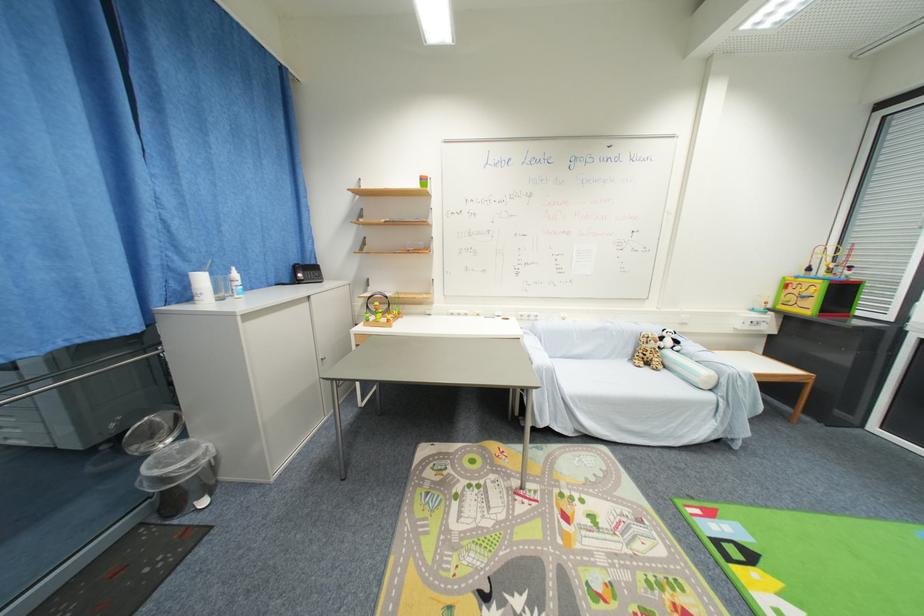
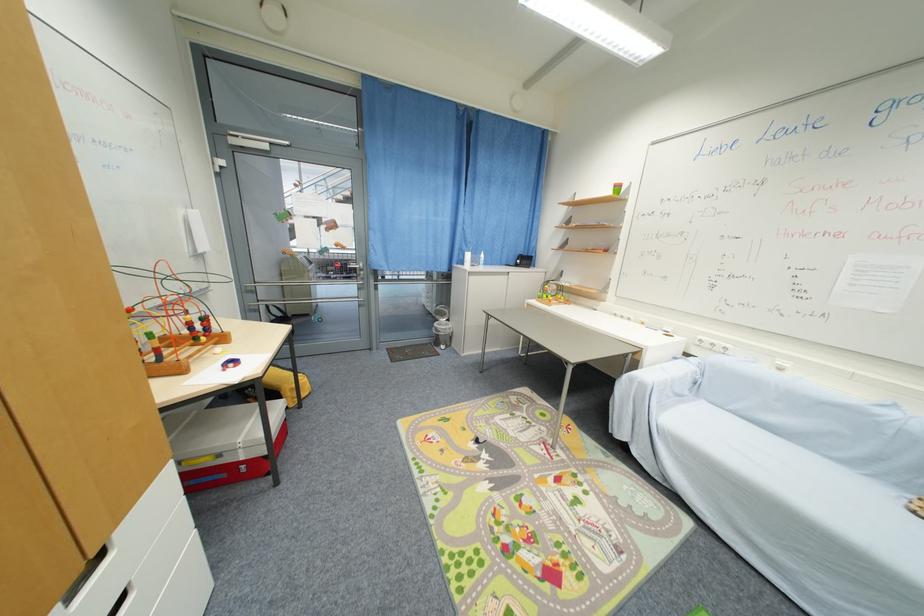
Find the pixel in the second image that matches (x=538, y=320) in the first image.

(723, 351)